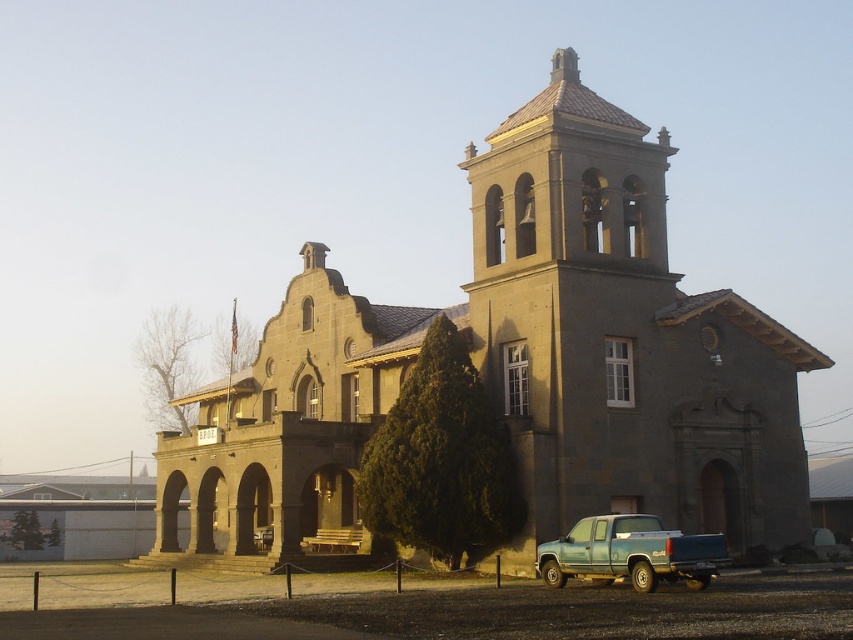
Question: Which object is the farthest from the gray stone bell tower at center?

Choices:
 (A) gray stone church at center
 (B) teal matte truck at lower right

Answer: (B)

Question: Can you confirm if gray stone church at center is wider than teal matte truck at lower right?

Choices:
 (A) yes
 (B) no

Answer: (A)

Question: Considering the real-world distances, which object is farthest from the gray stone bell tower at center?

Choices:
 (A) teal matte truck at lower right
 (B) gray stone church at center

Answer: (A)

Question: Which point is farther from the camera taking this photo?

Choices:
 (A) (280, 387)
 (B) (579, 413)
 (C) (672, 554)

Answer: (A)

Question: In this image, where is gray stone bell tower at center located relative to teal matte truck at lower right?

Choices:
 (A) left
 (B) right

Answer: (A)

Question: Is gray stone bell tower at center bigger than teal matte truck at lower right?

Choices:
 (A) no
 (B) yes

Answer: (B)